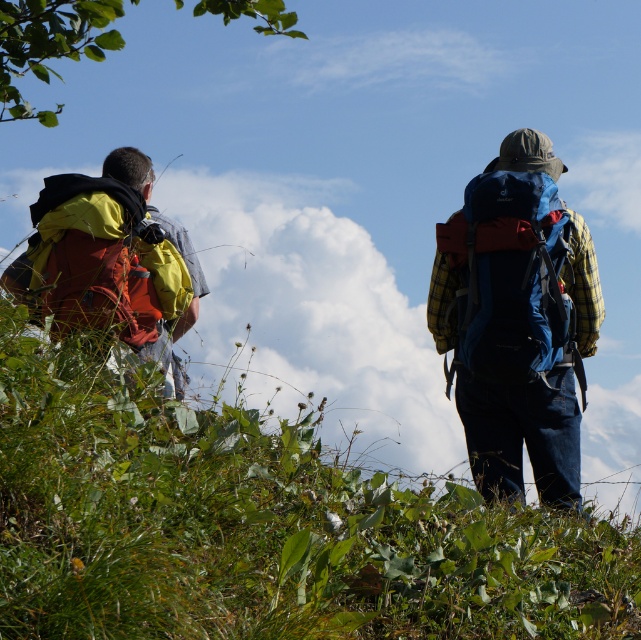
Question: Which of the following is the closest to the observer?

Choices:
 (A) (79, 211)
 (B) (565, 252)

Answer: (A)

Question: Is blue fabric backpack at right to the right of matte red backpack at left from the viewer's perspective?

Choices:
 (A) no
 (B) yes

Answer: (B)

Question: Among these objects, which one is nearest to the camera?

Choices:
 (A) blue fabric backpack at right
 (B) matte red backpack at left

Answer: (B)

Question: Is blue fabric backpack at right positioned behind matte red backpack at left?

Choices:
 (A) yes
 (B) no

Answer: (A)

Question: Does blue fabric backpack at right appear on the left side of matte red backpack at left?

Choices:
 (A) yes
 (B) no

Answer: (B)

Question: Which point is closer to the camera taking this photo?

Choices:
 (A) (520, 314)
 (B) (113, 296)

Answer: (B)